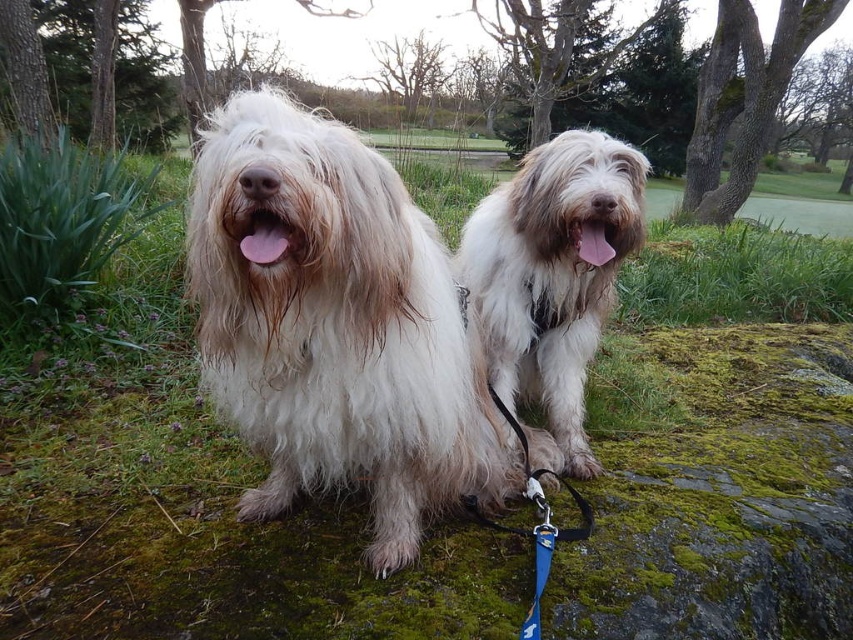
Between point (260, 444) and point (569, 352), which one is positioned in front?

Point (260, 444) is more forward.

Measure the distance between point (380, 250) and camera.

Point (380, 250) and camera are 1.26 meters apart from each other.

You are a GUI agent. You are given a task and a screenshot of the screen. Output one action in this format:
    pyautogui.click(x=<x>, y=<y>)
    Task: Click on the white fluffy dog at center
    
    Given the screenshot: What is the action you would take?
    pyautogui.click(x=334, y=324)

Between white fluffy dog at center and blue fabric leash at center, which one appears on the right side from the viewer's perspective?

Positioned to the right is blue fabric leash at center.

Which is behind, point (219, 244) or point (531, 291)?

Positioned behind is point (531, 291).

Find the location of a particular element. Image resolution: width=853 pixels, height=640 pixels. white fluffy dog at center is located at coordinates (334, 324).

This screenshot has height=640, width=853. Identify the location of white fluffy dog at center. (334, 324).

Does point (584, 180) come behind point (532, 317)?

No, (584, 180) is closer to viewer.

Is the position of fuzzy white dog at center less distant than that of blue fabric leash at center?

Yes, it is.

The width and height of the screenshot is (853, 640). In order to click on fuzzy white dog at center in this screenshot , I will do `click(553, 272)`.